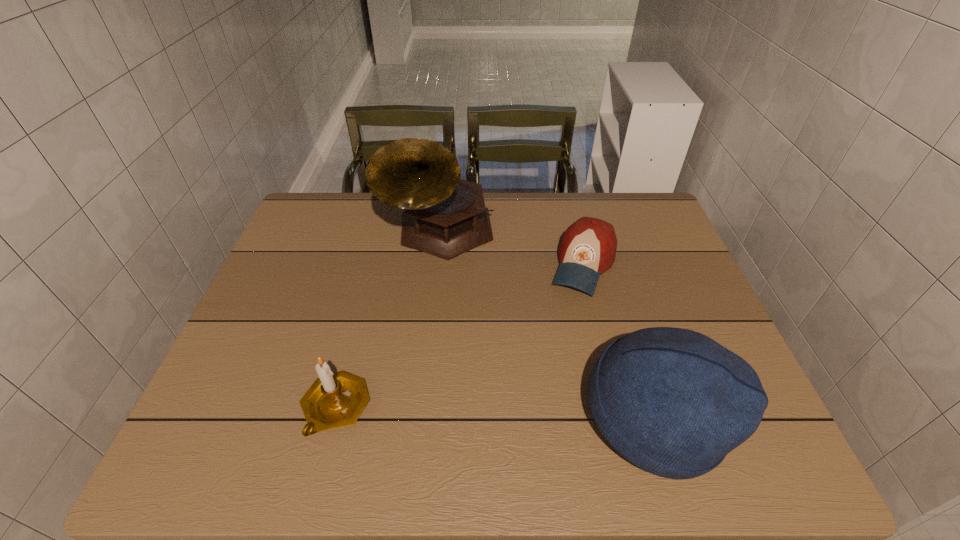
The height and width of the screenshot is (540, 960). I want to click on candle holder, so click(x=334, y=400).

Find the location of a particular element. The width and height of the screenshot is (960, 540). skullcap is located at coordinates (673, 402).

Locate an element on the screen. the shortest object is located at coordinates (587, 249).

Image resolution: width=960 pixels, height=540 pixels. What are the coordinates of `phonograph record` in the screenshot? It's located at (445, 216).

This screenshot has width=960, height=540. Identify the location of vacant region located 0.060m on the right of the skullcap. coord(754,416).

I want to click on vacant space located 0.190m on the front-facing side of the shortest object, so click(556, 349).

Where is `free spot located on the front-facing side of the shortest object`? The image size is (960, 540). free spot located on the front-facing side of the shortest object is located at coordinates pyautogui.click(x=551, y=362).

Where is `free spot located 0.360m on the front-facing side of the shortest object`? free spot located 0.360m on the front-facing side of the shortest object is located at coordinates (533, 409).

Find the location of a particular element. This screenshot has height=540, width=960. vacant space located 0.310m on the horn direction of the phonograph record is located at coordinates (444, 363).

At what (x,y) coordinates should I click in order to perform the action: click on blank area located on the horn direction of the phonograph record. Please return your answer as a coordinate pair (x, y). Looking at the image, I should click on (442, 286).